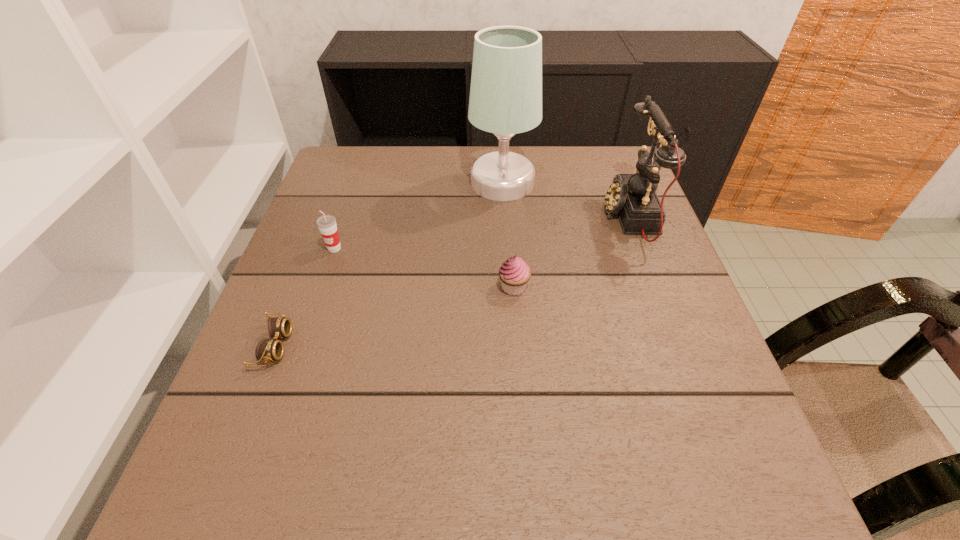
Identify the location of vacant space in between the fourth tallest object and the third shortest object. This screenshot has width=960, height=540. (424, 268).

The image size is (960, 540). Identify the location of free space between the tallest object and the second tallest object. pos(566,199).

Where is `object that ranks as the second closest to the cupcake`? Image resolution: width=960 pixels, height=540 pixels. object that ranks as the second closest to the cupcake is located at coordinates (505, 99).

At what (x,y) coordinates should I click in order to perform the action: click on object that is the nearest to the cupcake. Please return your answer as a coordinate pair (x, y). Looking at the image, I should click on (633, 197).

Locate an element on the screen. vacant region that satisfies the following two spatial constraints: 1. on the base of the fourth tallest object; 2. on the left side of the lampshade is located at coordinates (509, 287).

Image resolution: width=960 pixels, height=540 pixels. I want to click on free space that satisfies the following two spatial constraints: 1. on the side of the cup with the logo; 2. on the left side of the cupcake, so click(x=322, y=287).

In order to click on vacant region that satisfies the following two spatial constraints: 1. on the side of the third tallest object with the logo; 2. through the lenses of the nearest object in this screenshot , I will do [x=301, y=346].

Identify the location of free space that satisfies the following two spatial constraints: 1. on the base of the lampshade; 2. on the back side of the second shortest object. The image size is (960, 540). (509, 287).

What are the coordinates of `vacant space that satisfies the following two spatial constraints: 1. on the dial of the rightmost object; 2. on the side of the cup with the logo` in the screenshot? It's located at (642, 248).